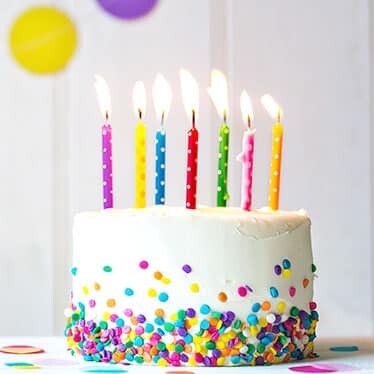
Identify the location of candle flame. (102, 103), (140, 104), (165, 99), (193, 99), (221, 99), (243, 109), (269, 105).